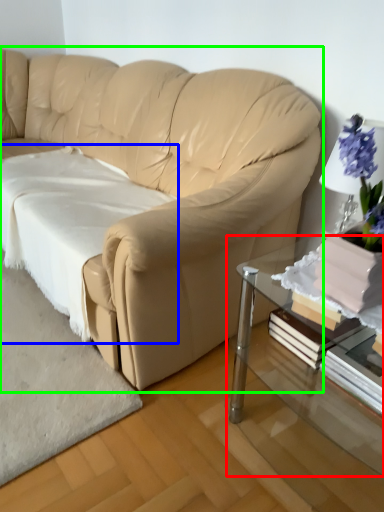
Question: Which object is positioned farthest from table (highlighted by a red box)? Select from sheet (highlighted by a blue box) and studio couch (highlighted by a green box).

Choices:
 (A) sheet
 (B) studio couch

Answer: (A)